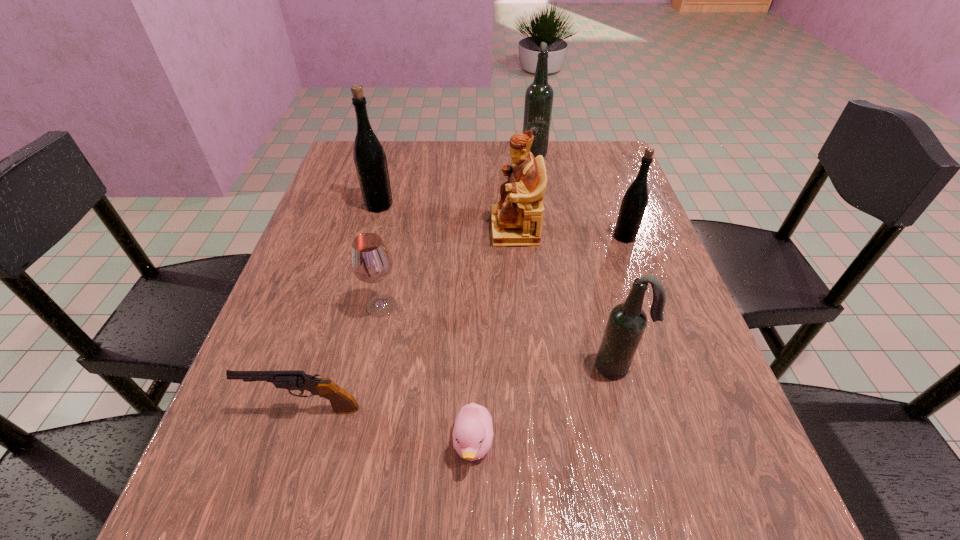
Find the location of `the second beer bottle from left to right`. the second beer bottle from left to right is located at coordinates (539, 95).

Find the location of a particular element. the farthest beer bottle is located at coordinates (539, 95).

Locate an element on the screen. This screenshot has width=960, height=540. the farther green beer bottle is located at coordinates (369, 156).

Identify the location of the leftmost beer bottle. This screenshot has height=540, width=960. (369, 156).

You are a GUI agent. You are given a task and a screenshot of the screen. Output one action in this format:
    pyautogui.click(x=<x>, y=<y>)
    Task: Click on the figurine
    
    Given the screenshot: What is the action you would take?
    pyautogui.click(x=516, y=220)

This screenshot has height=540, width=960. Identify the location of the rightmost beer bottle. (634, 203).

This screenshot has width=960, height=540. What are the coordinates of `the right green beer bottle` in the screenshot? It's located at (634, 203).

Image resolution: width=960 pixels, height=540 pixels. Find the location of `the second object from right to left`. the second object from right to left is located at coordinates (627, 321).

In order to click on the second beer bottle from right to left in this screenshot , I will do `click(627, 321)`.

Where is `wineglass`? The width and height of the screenshot is (960, 540). wineglass is located at coordinates (371, 261).